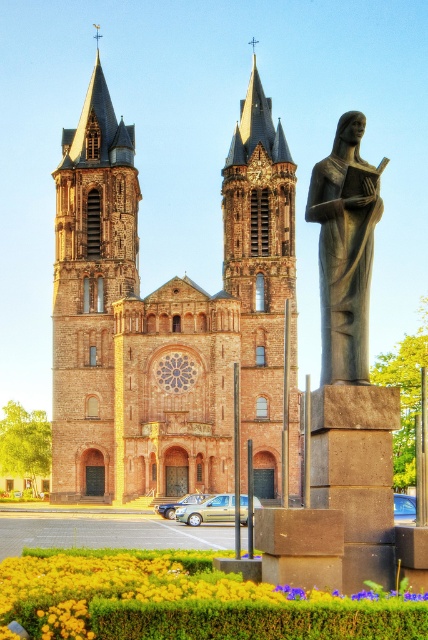
How far apart are brown stone church towers at center and gray stone statue at right?

They are 16.49 meters apart.

What do you see at coordinates (169, 321) in the screenshot?
I see `brown stone church towers at center` at bounding box center [169, 321].

Image resolution: width=428 pixels, height=640 pixels. I want to click on brown stone church towers at center, so click(x=169, y=321).